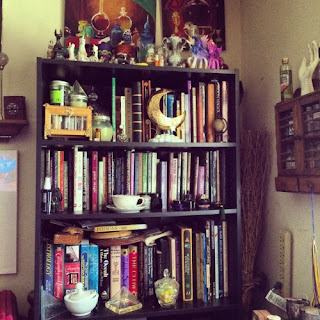
Identify the location of horizontal books. [x=125, y=228], [x=122, y=232], [x=132, y=239], [x=76, y=237], [x=76, y=232].